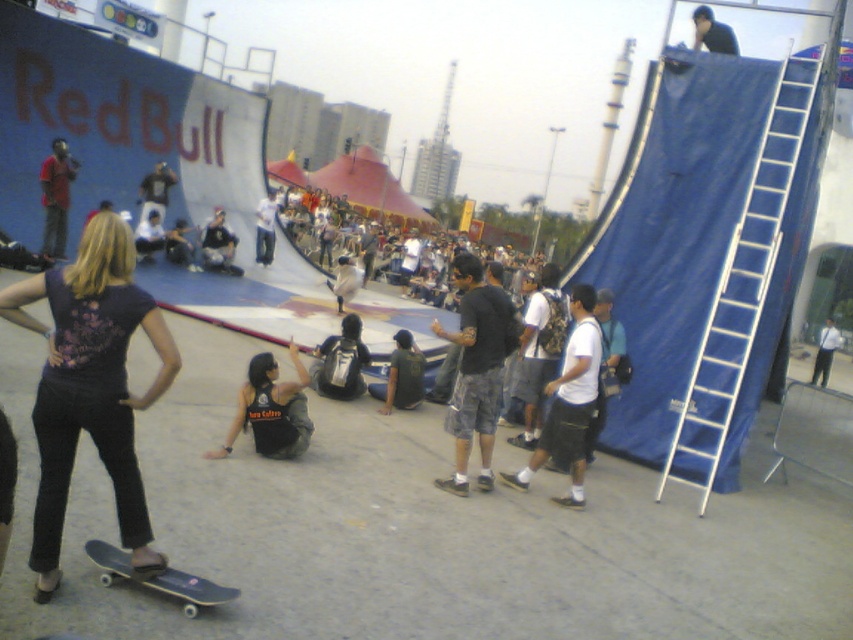
You are a photographer at the skateboarding event and want to capture a photo of the two groups of people wearing the matte black shirt at upper left and black matte shirt at upper center. The camera you are using has a maximum focus range of 10 meters. Will you be able to capture both groups in focus if they are positioned 9.06 meters apart?

Yes, the distance between the matte black shirt at upper left and black matte shirt at upper center is 9.06 meters, which is within the camera maximum focus range of 10 meters. Therefore, both groups can be captured in focus.